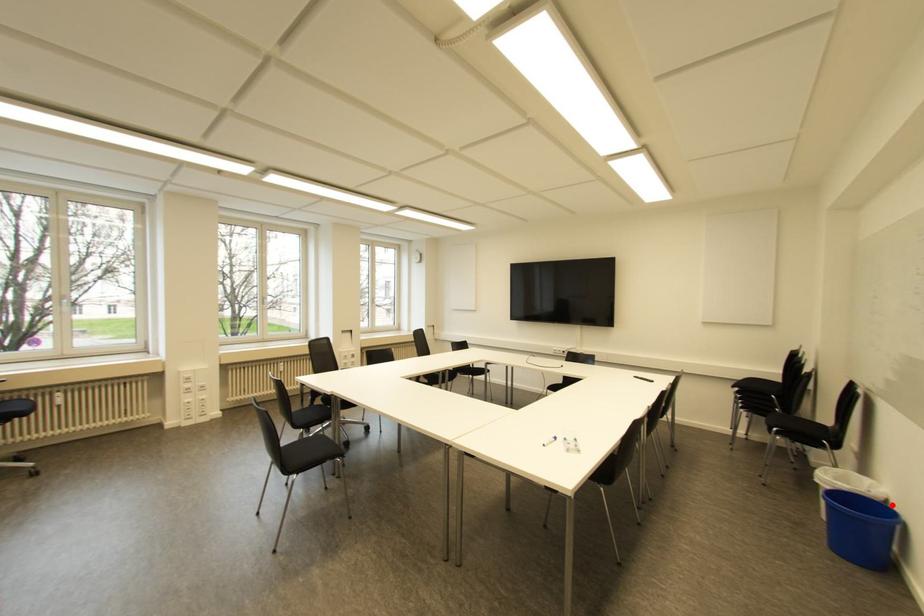
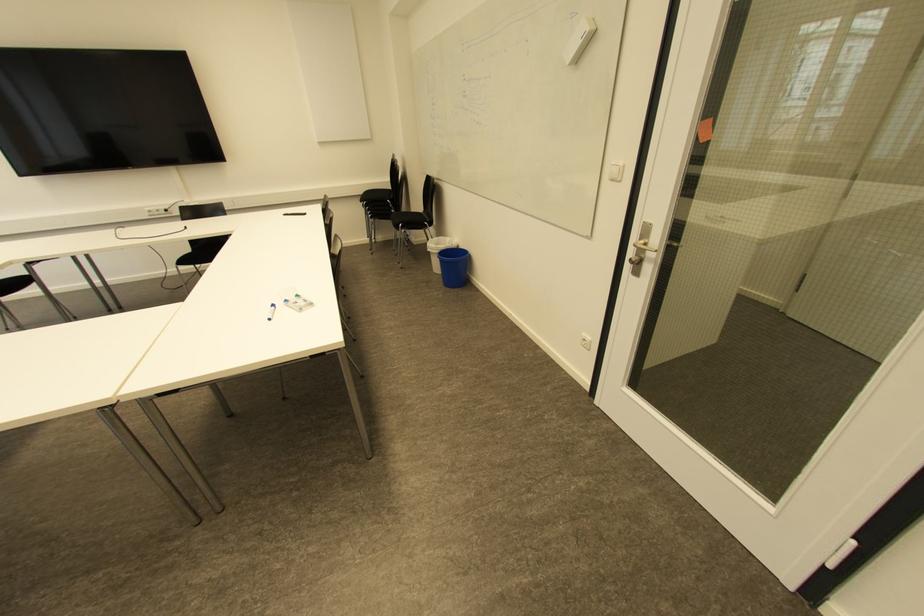
Where in the second image is the point corresponding to the highlighted location from the first image?

(460, 246)